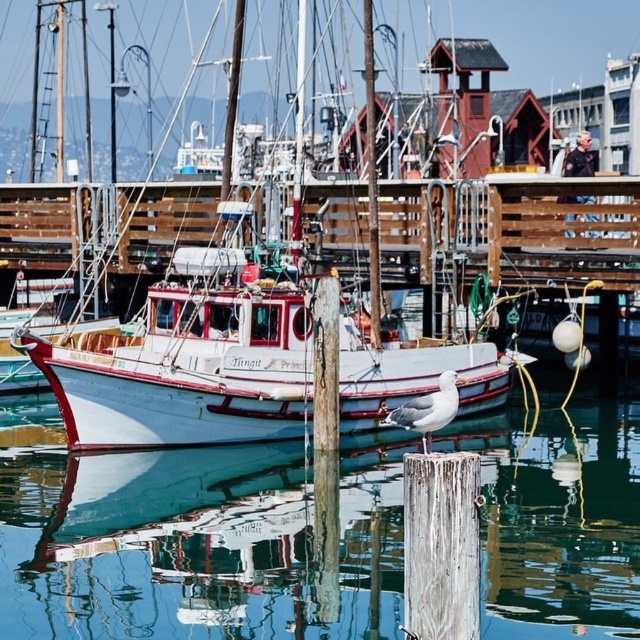
Question: Does white glossy boat at center have a smaller size compared to white feathered seagull at center?

Choices:
 (A) no
 (B) yes

Answer: (A)

Question: Is the position of clear water at center more distant than that of white feathered seagull at center?

Choices:
 (A) yes
 (B) no

Answer: (B)

Question: Is white matte boat at center bigger than white feathered seagull at center?

Choices:
 (A) yes
 (B) no

Answer: (A)

Question: Which point appears farthest from the camera in this image?

Choices:
 (A) (406, 344)
 (B) (440, 422)

Answer: (A)

Question: Which point appears farthest from the camera in this image?

Choices:
 (A) (42, 502)
 (B) (417, 397)
 (C) (172, 296)
 (D) (236, 260)

Answer: (C)

Question: Considering the real-world distances, which object is closest to the white feathered seagull at center?

Choices:
 (A) white matte boat at center
 (B) white glossy boat at center
 (C) clear water at center

Answer: (C)